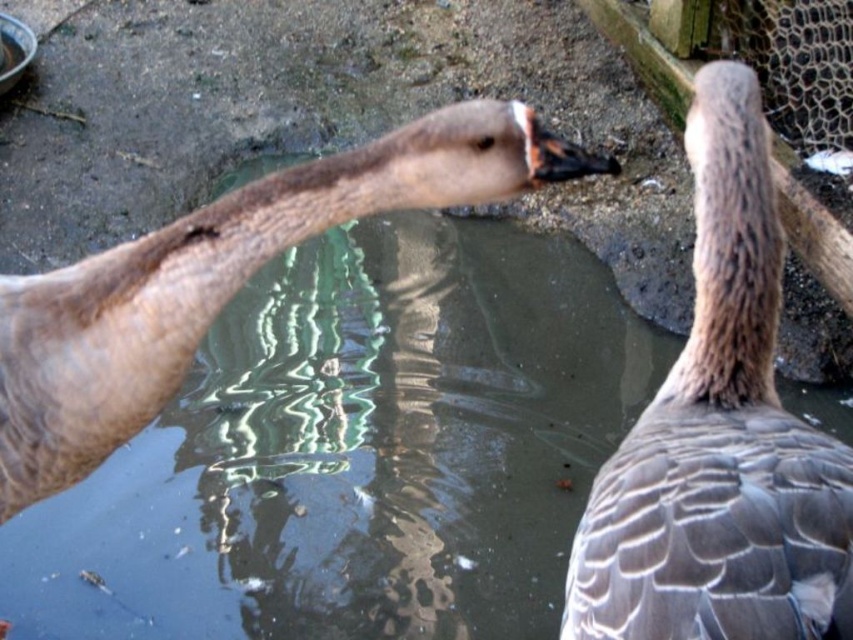
You are a farmer observing the pond and want to place a floating platform that can accommodate both the gray feathered duck at center and the brown feathered duck at left simultaneously. Considering their sizes, which duck requires more space on the platform?

The brown feathered duck at left requires more space on the platform since it has a greater width than the gray feathered duck at center.